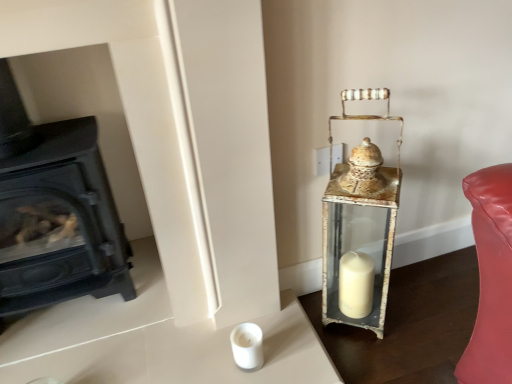
Question: Is antique brass lantern at right wider or thinner than black matte wood burning stove at left?

Choices:
 (A) thin
 (B) wide

Answer: (A)

Question: In the image, is antique brass lantern at right positioned in front of or behind black matte wood burning stove at left?

Choices:
 (A) front
 (B) behind

Answer: (B)

Question: Based on their positions, is antique brass lantern at right located to the left or right of black matte wood burning stove at left?

Choices:
 (A) left
 (B) right

Answer: (B)

Question: Would you say black matte wood burning stove at left is to the left or to the right of antique brass lantern at right in the picture?

Choices:
 (A) right
 (B) left

Answer: (B)

Question: Is black matte wood burning stove at left in front of or behind antique brass lantern at right in the image?

Choices:
 (A) behind
 (B) front

Answer: (B)

Question: Does point (73, 266) appear closer or farther from the camera than point (388, 99)?

Choices:
 (A) closer
 (B) farther

Answer: (B)

Question: Looking at the image, does black matte wood burning stove at left seem bigger or smaller compared to antique brass lantern at right?

Choices:
 (A) big
 (B) small

Answer: (A)